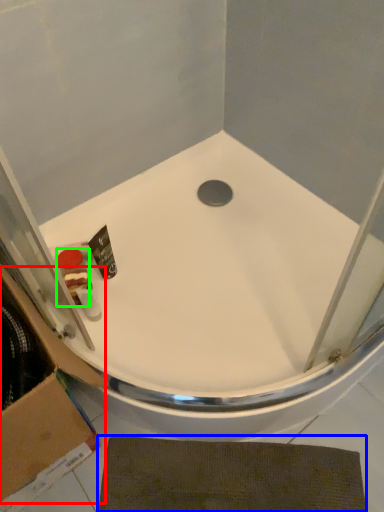
Question: Considering the real-world distances, which object is farthest from cardboard box (highlighted by a red box)? bath mat (highlighted by a blue box) or toiletry (highlighted by a green box)?

Choices:
 (A) bath mat
 (B) toiletry

Answer: (B)